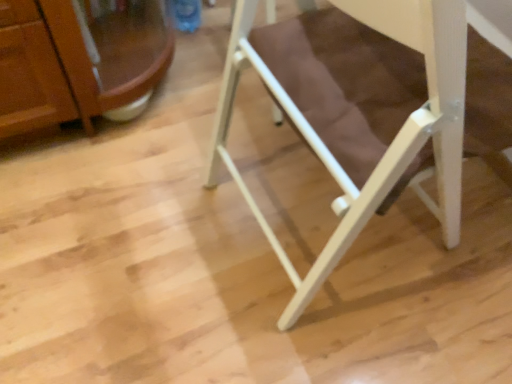
Where is `free space in front of matte brown cushion at center`? This screenshot has height=384, width=512. free space in front of matte brown cushion at center is located at coordinates (326, 340).